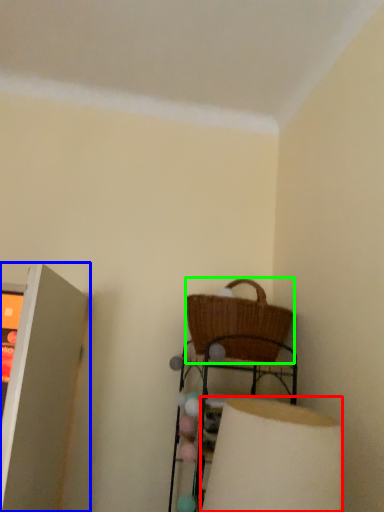
Question: Which is nearer to the lamp (highlighted by a red box)? shelf (highlighted by a blue box) or picnic basket (highlighted by a green box).

Choices:
 (A) shelf
 (B) picnic basket

Answer: (B)